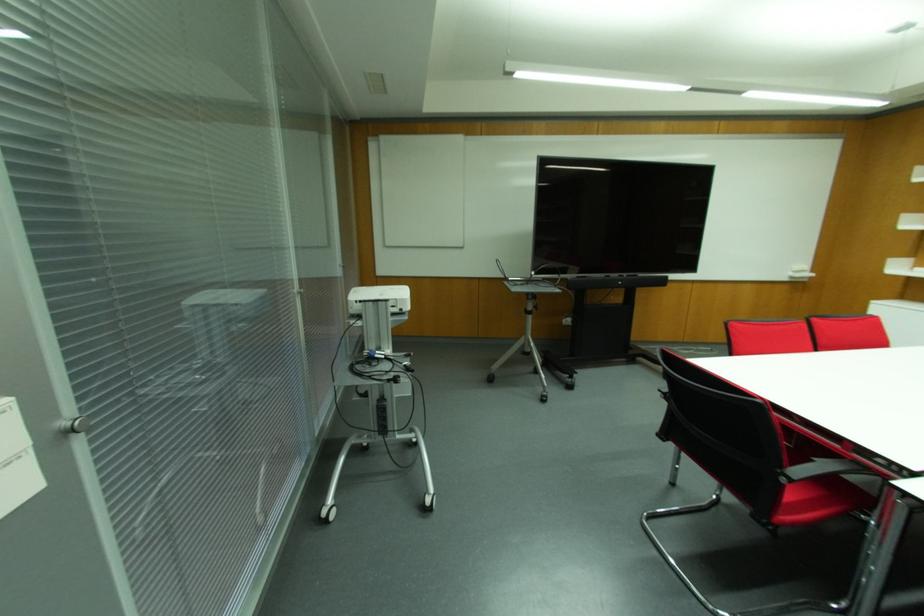
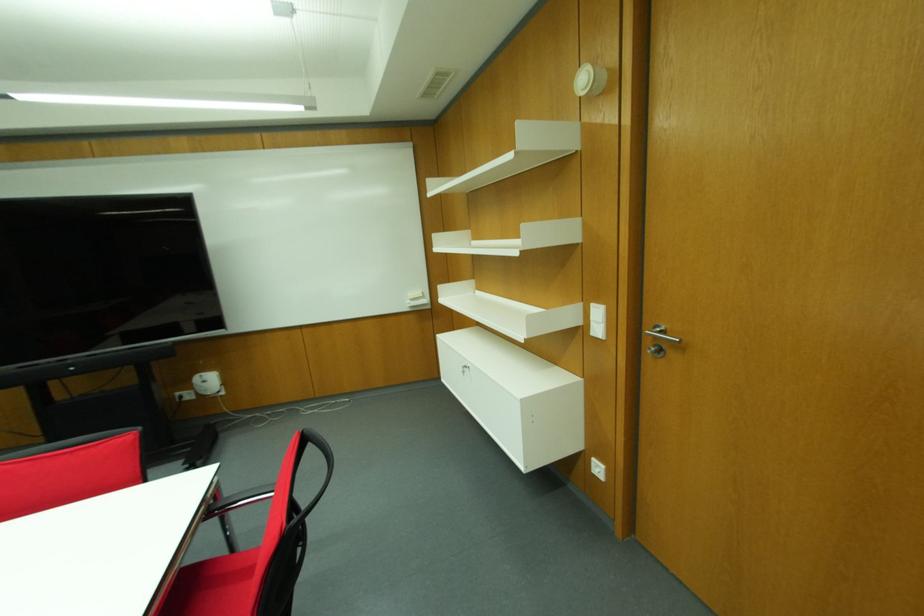
Question: In a continuous first-person perspective shot, in which direction is the camera moving?

Choices:
 (A) Left
 (B) Right
 (C) Forward
 (D) Backward

Answer: (B)